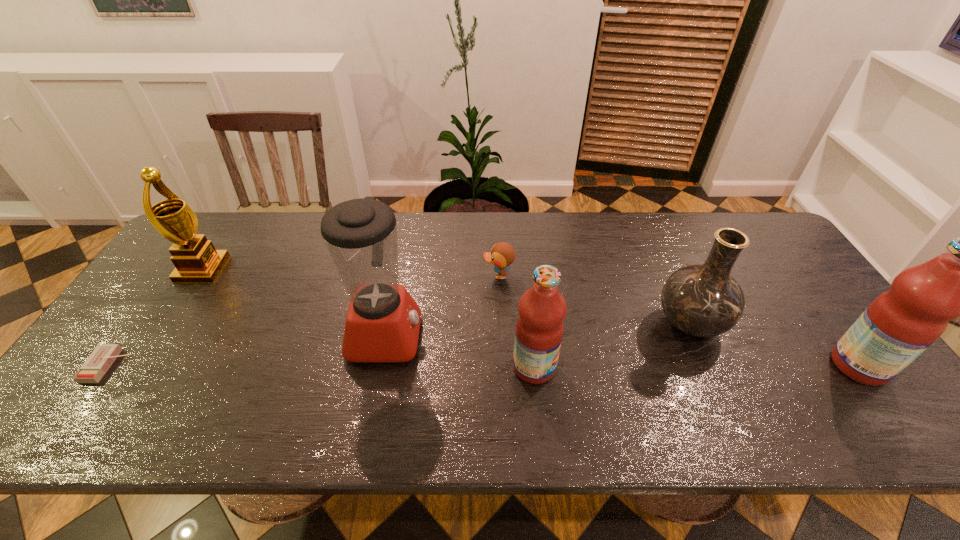
Locate which object ranks sixth in proximity to the award. Please provide its 2D coordinates. Your answer should be formatted as a tuple, i.e. [(x, y)], where the tuple contains the x and y coordinates of a point satisfying the conditions above.

[(901, 323)]

The image size is (960, 540). In order to click on blank space that satisfies the following two spatial constraints: 1. on the front side of the vase; 2. on the front label of the left fruit juice in this screenshot , I will do `click(708, 367)`.

At what (x,y) coordinates should I click in order to perform the action: click on vacant space that satisfies the following two spatial constraints: 1. on the front side of the second object from right to left; 2. on the front label of the left fruit juice. Please return your answer as a coordinate pair (x, y). This screenshot has height=540, width=960. Looking at the image, I should click on (708, 367).